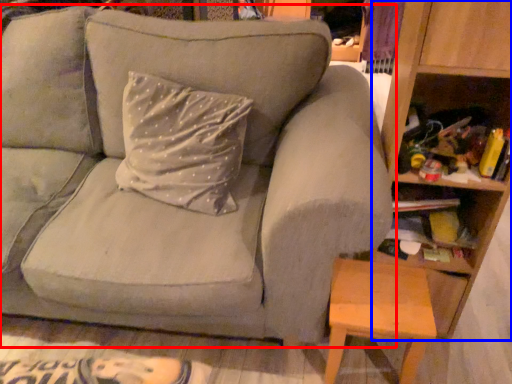
Question: Which object appears farthest to the camera in this image, studio couch (highlighted by a red box) or bookshelf (highlighted by a blue box)?

Choices:
 (A) studio couch
 (B) bookshelf

Answer: (B)